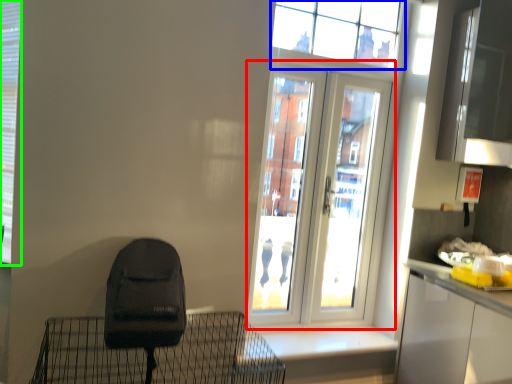
Question: Which object is the farthest from door (highlighted by a red box)? Choose among these: window (highlighted by a blue box) or shutter (highlighted by a green box).

Choices:
 (A) window
 (B) shutter

Answer: (B)